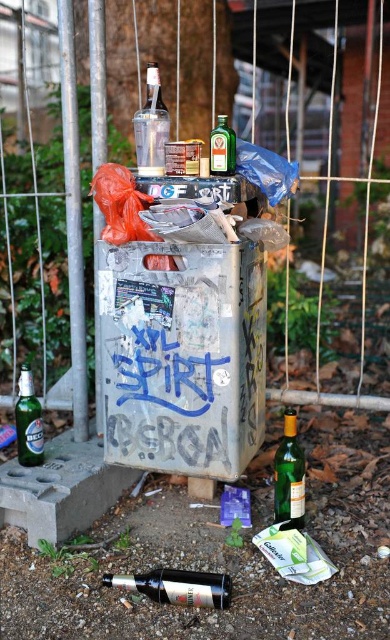
You are a sanitation worker standing in front of the silver metallic trash can at center. You need to empty the contents into a larger bin that is 2 meters away. Can you reach the trash can from your current position without moving closer?

The silver metallic trash can at center is 1.40 meters away from the viewer. Since the worker is already 1.40 meters away and the larger bin is 2 meters away, they would need to move closer to reach the trash can effectively. Therefore, they cannot reach it without moving closer.

You are a photographer standing in front of the trash bin. You want to capture both the blue graffiti at center and the translucent glass wine bottle at lower center in your shot. Which object should you focus on first if you want to ensure both are in clear view?

The blue graffiti at center is further to the viewer than the translucent glass wine bottle at lower center, so you should focus on the blue graffiti at center first to ensure both are in clear view.

You are a photographer standing at the camera position. You want to capture a closeup shot of the clear glass bottle at upper center. Can you reach it with your hand without moving the camera? The camera has a 1.5 meter long arm attached to it.

The clear glass bottle at upper center is 1.53 meters away from the camera. Since the camera arm is only 1.5 meters long, you cannot reach it with your hand without moving the camera.